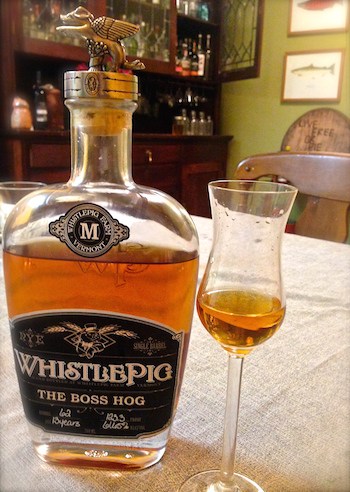
Identify the location of fish painting. The image size is (350, 492). (300, 85).